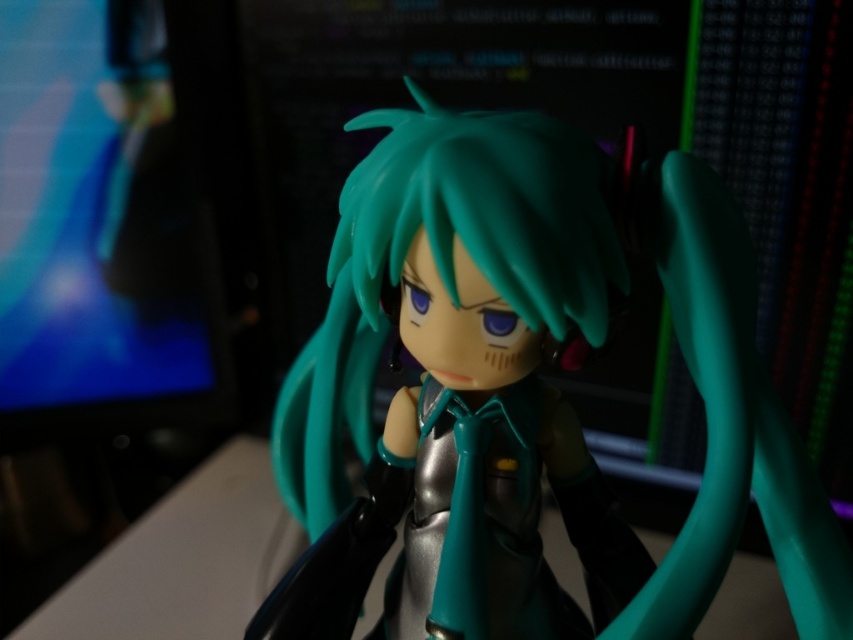
You are setting up a display for a gaming event. You have a figurine with teal glossy hair at center and a matte black monitor at left. The monitor needs to be positioned so that it doesn not block the view of the figurine. Based on their sizes, which object should be placed further back to ensure the figurine remains visible?

The matte black monitor at left should be placed further back because its width is greater than the teal glossy hair at center, allowing the figurine to stay visible in the foreground.

You are an interior designer working on a virtual reality project. You need to place a new object in the scene so that it will be visible in the reflection of the monitor. Where should you place the object relative to the point marked by point (100,230)?

The object should be placed in front of the matte black monitor at left, which is marked by point (100,230), to ensure it reflects in the monitor.

You are a graphic designer working on a project and need to locate the matte black monitor at left in the scene. Based on the coordinates provided, where should you look to find it?

The matte black monitor at left is located at coordinates point (100, 230).